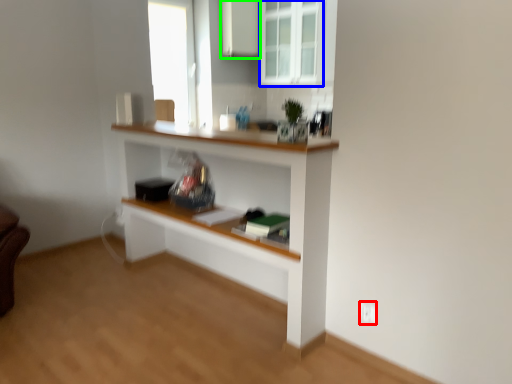
Question: Estimate the real-world distances between objects in this image. Which object is closer to electric outlet (highlighted by a red box), window (highlighted by a blue box) or cabinetry (highlighted by a green box)?

Choices:
 (A) window
 (B) cabinetry

Answer: (A)